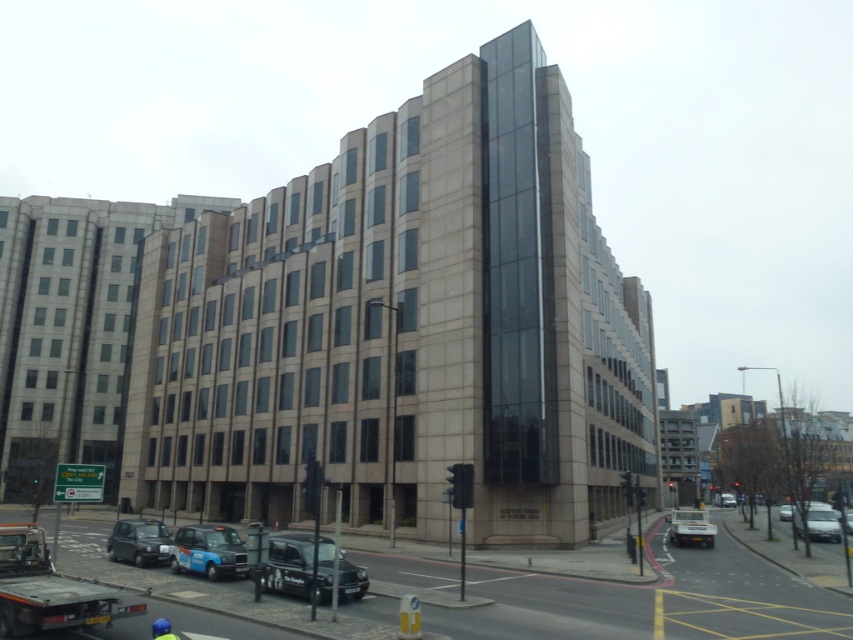
You are a pedestrian standing on the sidewalk in front of the large building. You see the blue metallic taxi at lower center and the metallic silver car at lower right. Which vehicle is nearer to you?

The blue metallic taxi at lower center is closer to the viewer than the metallic silver car at lower right, so the blue metallic taxi at lower center is nearer to you.

You are a delivery driver approaching the building and need to park your vehicle. The parking lot requires vehicles to be parked at coordinates between 0.8 and 0.9 on the x and y axes. Is the black matte taxi at lower center parked within the designated area?

The black matte taxi at lower center is parked at coordinates 0.883 on the x and 0.339 on the y. Since the y coordinate is below 0.3, it is outside the designated parking area between 0.8 and 0.9 on both axes.

Looking at this image, you are a pedestrian standing on the sidewalk in front of the large building. You need to hail a taxi that is taller than the other. Which taxi should you choose between the black matte taxi at lower center and the blue metallic taxi at lower center?

You should choose the blue metallic taxi at lower center because it is taller than the black matte taxi at lower center.